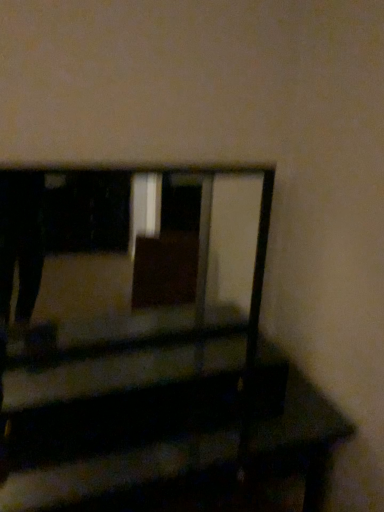
In order to face metallic dark brown table at lower right, should I rotate leftwards or rightwards?

Rotate your view left by about 4.527°.

What do you see at coordinates (108, 460) in the screenshot? The image size is (384, 512). I see `metallic dark brown table at lower right` at bounding box center [108, 460].

Measure the distance between metallic dark brown table at lower right and camera.

metallic dark brown table at lower right and camera are 37.40 inches apart from each other.

Locate an element on the screen. This screenshot has width=384, height=512. metallic dark brown table at lower right is located at coordinates (108, 460).

What is the approximate width of metallic dark brown table at lower right?

19.98 inches.

Locate an element on the screen. The height and width of the screenshot is (512, 384). metallic dark brown table at lower right is located at coordinates (108, 460).